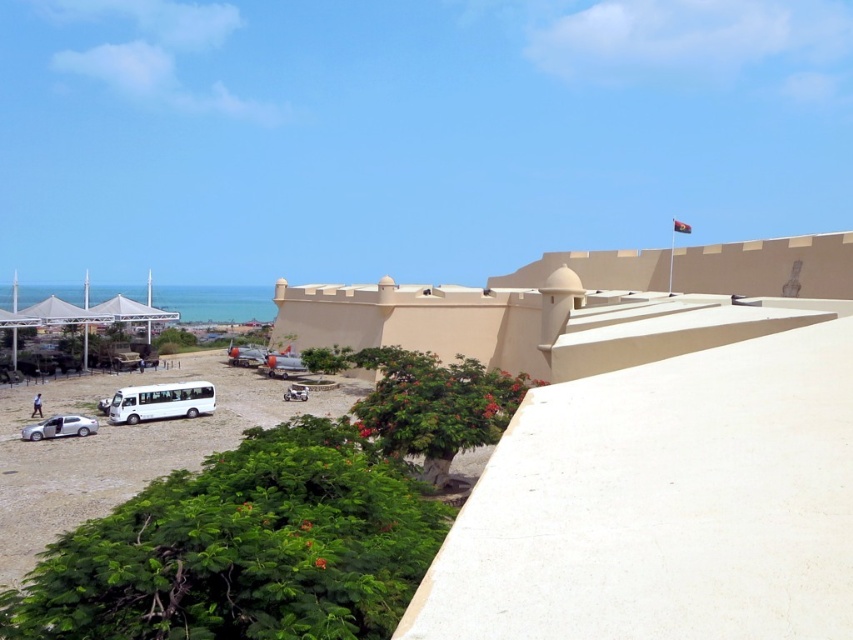
What is the exact coordinate of the white sand beach at lower left in the image?

The white sand beach at lower left is located at coordinate point [125,445].

You are standing at the white sand beach at lower left and want to reach the white matte car at center. Which direction should you move towards?

You should move towards the right to reach the white matte car at center since the white sand beach at lower left is to the left of it.